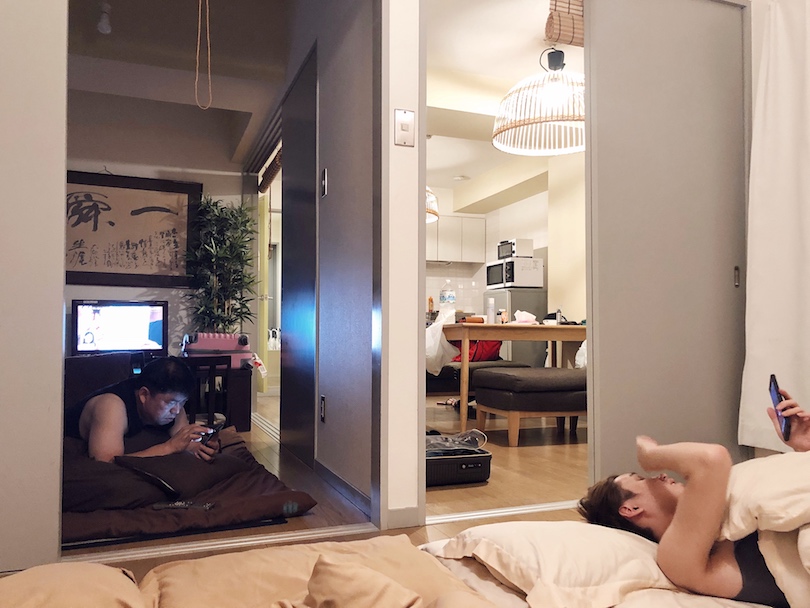
This screenshot has width=810, height=608. In order to click on pillows in this screenshot , I will do `click(568, 554)`, `click(769, 499)`, `click(359, 592)`.